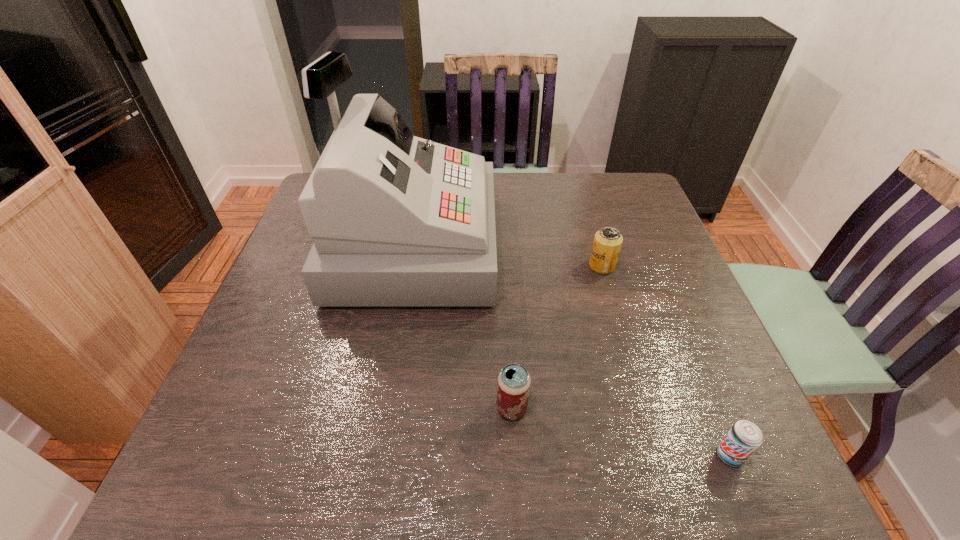
The height and width of the screenshot is (540, 960). Identify the location of the tallest object. (397, 221).

Locate an element on the screen. The height and width of the screenshot is (540, 960). the farthest beer can is located at coordinates (607, 243).

At what (x,y) coordinates should I click in order to perform the action: click on the third object from left to right. Please return your answer as a coordinate pair (x, y). Looking at the image, I should click on (607, 243).

Image resolution: width=960 pixels, height=540 pixels. In order to click on the leftmost beer can in this screenshot , I will do `click(513, 386)`.

In order to click on the third farthest object in this screenshot , I will do (x=513, y=386).

Where is `the rightmost object`? the rightmost object is located at coordinates (744, 437).

Locate an element on the screen. This screenshot has height=540, width=960. the shortest beer can is located at coordinates [x=744, y=437].

Identify the location of blank space located on the keypad side of the cash register. This screenshot has height=540, width=960. (579, 246).

Find the location of a particular element. This screenshot has height=540, width=960. vacant space located on the front of the second object from right to left is located at coordinates (617, 320).

You are a GUI agent. You are given a task and a screenshot of the screen. Output one action in this format:
    pyautogui.click(x=<x>, y=<y>)
    Task: Click on the free space located 0.320m on the right of the leftmost beer can
    Image resolution: width=960 pixels, height=540 pixels.
    Given the screenshot: What is the action you would take?
    pyautogui.click(x=693, y=409)